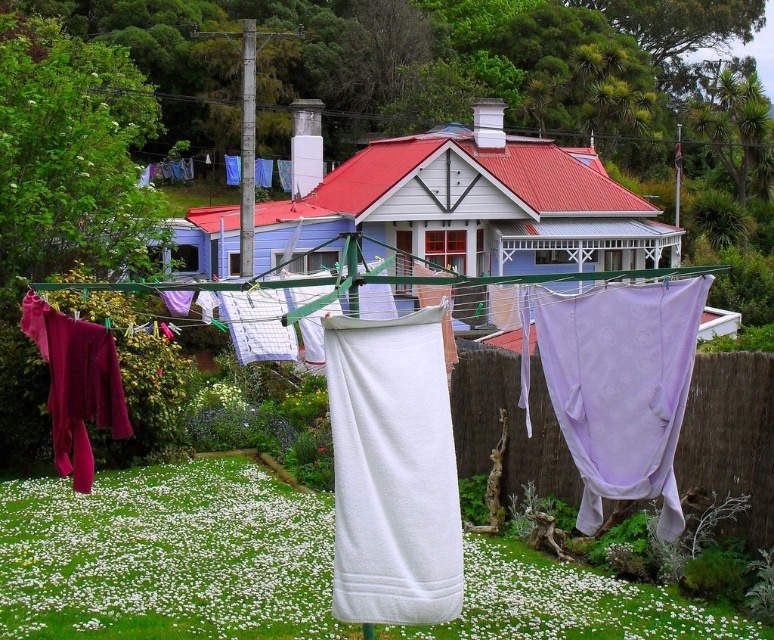
You are a delivery person standing at the front door of the house. You need to place a package on the clothesline between the white towel at center and the velvet maroon pants at lower left. Can you fit the package there if it requires 10 feet of space?

The distance between the white towel at center and the velvet maroon pants at lower left is 11.51 feet, which is more than enough to accommodate the package needing 10 feet of space.

You are a gardener trying to plant flowers between the white soft grass at center and the white fabric at center. Which area has more space to accommodate the flowers?

The white soft grass at center might be wider than the white fabric at center, so there is more space available in the white soft grass at center area to plant the flowers.

You are a person standing at the front door of the house. You want to walk to the clothesline to collect your laundry. Which direction should you walk to reach the clothesline first without crossing the white soft grass at center?

Since the white soft grass at center is located at point (x=166, y=556), which is closer to the bottom of the image, you should walk forward towards the clothesline in the foreground without crossing the white soft grass at center.